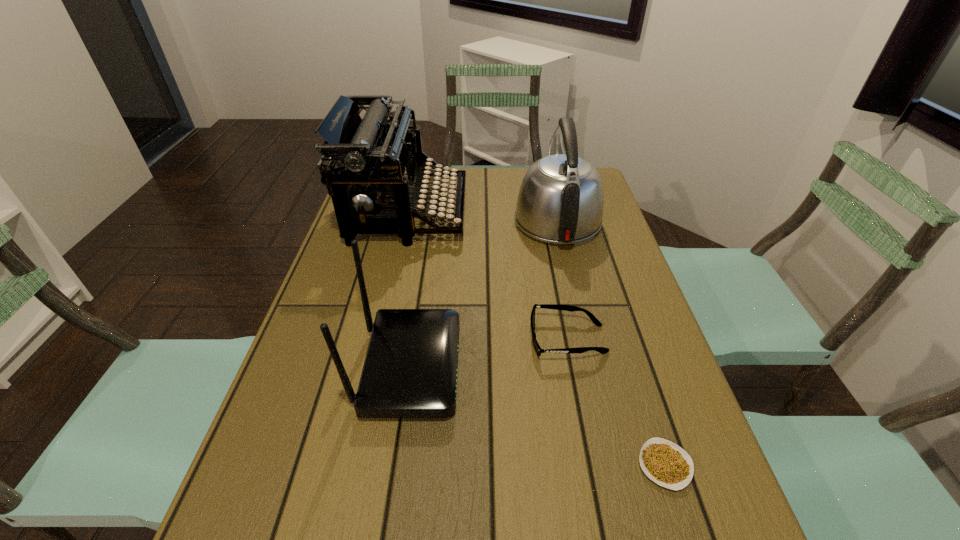
Identify the location of blank space located on the front-facing side of the third tallest object. (482, 368).

Where is `vacant area situated on the front-facing side of the sunglasses`? This screenshot has width=960, height=540. vacant area situated on the front-facing side of the sunglasses is located at coordinates (404, 339).

Locate an element on the screen. This screenshot has width=960, height=540. blank area located on the front-facing side of the sunglasses is located at coordinates (368, 339).

This screenshot has height=540, width=960. What are the coordinates of `vacant space located on the front-facing side of the sunglasses` in the screenshot? It's located at (354, 339).

Locate an element on the screen. This screenshot has width=960, height=540. free space located on the left of the shortest object is located at coordinates (466, 465).

The width and height of the screenshot is (960, 540). I want to click on typewriter that is at the far edge, so click(x=373, y=159).

Where is `kettle at the far edge`? kettle at the far edge is located at coordinates (560, 201).

You are a GUI agent. You are given a task and a screenshot of the screen. Output one action in this format:
    pyautogui.click(x=<x>, y=<y>)
    Task: Click on the typewriter that is at the left edge
    This screenshot has width=960, height=540.
    Given the screenshot: What is the action you would take?
    coord(373,159)

The height and width of the screenshot is (540, 960). Find the location of `router that is at the left edge`. router that is at the left edge is located at coordinates (410, 370).

This screenshot has width=960, height=540. What are the coordinates of `kettle situated at the right edge` in the screenshot? It's located at (560, 201).